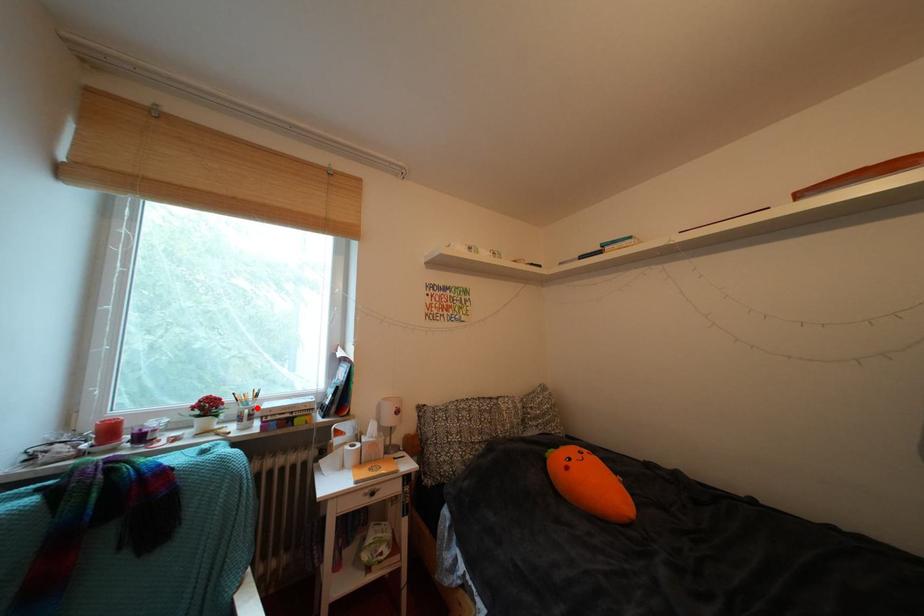
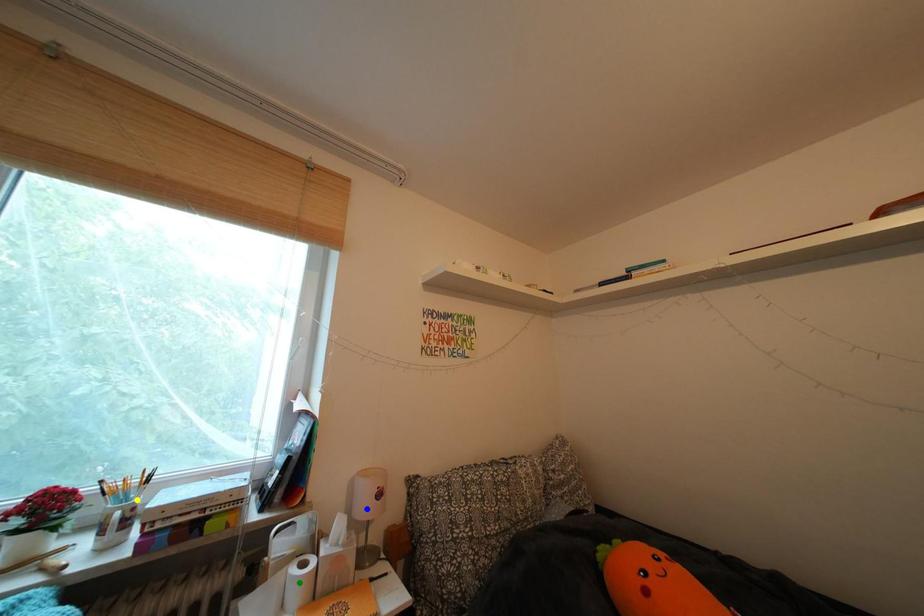
Question: I am providing you with two images of the same scene from different viewpoints. A red point is marked on the first image. You are given multiple points on the second image. Which point in image 2 represents the same 3d spot as the red point in image 1?

Choices:
 (A) yellow point
 (B) green point
 (C) blue point

Answer: (A)